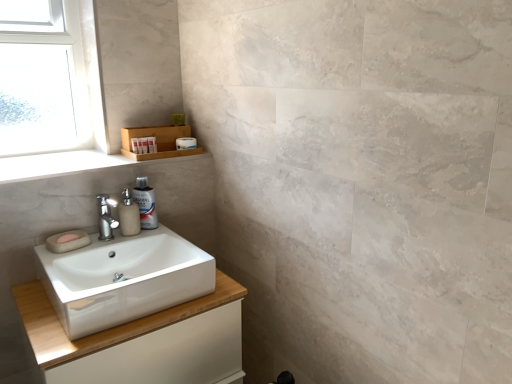
Identify the location of vacant region in front of white matte tube at upper left, placed as the 1th toiletry when sorted from back to front. (135, 160).